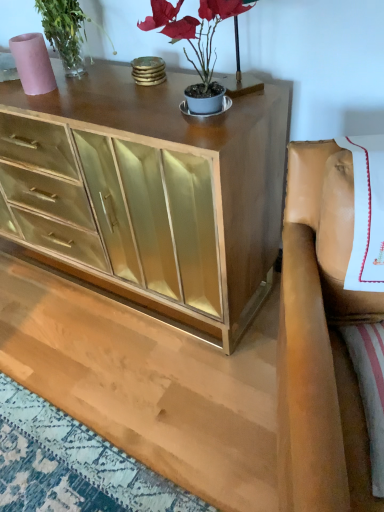
Question: Can you confirm if matte pink vase at upper left is taller than matte gold plant at upper center?

Choices:
 (A) yes
 (B) no

Answer: (B)

Question: Does matte pink vase at upper left appear on the left side of matte gold plant at upper center?

Choices:
 (A) yes
 (B) no

Answer: (A)

Question: Are matte pink vase at upper left and matte gold plant at upper center located far from each other?

Choices:
 (A) no
 (B) yes

Answer: (A)

Question: Does matte pink vase at upper left lie behind matte gold plant at upper center?

Choices:
 (A) no
 (B) yes

Answer: (B)

Question: Is matte pink vase at upper left bigger than matte gold plant at upper center?

Choices:
 (A) yes
 (B) no

Answer: (B)

Question: From a real-world perspective, is leather at right above or below matte gold plant at upper center?

Choices:
 (A) above
 (B) below

Answer: (B)

Question: From the image's perspective, relative to matte gold plant at upper center, is leather at right above or below?

Choices:
 (A) below
 (B) above

Answer: (A)

Question: Would you say leather at right is inside or outside matte gold plant at upper center?

Choices:
 (A) inside
 (B) outside

Answer: (B)

Question: Looking at the image, does leather at right seem bigger or smaller compared to matte gold plant at upper center?

Choices:
 (A) big
 (B) small

Answer: (A)

Question: Is point (331, 187) positioned closer to the camera than point (39, 60)?

Choices:
 (A) closer
 (B) farther

Answer: (A)

Question: From the image's perspective, relative to matte pink vase at upper left, is leather at right above or below?

Choices:
 (A) above
 (B) below

Answer: (B)

Question: In terms of size, does leather at right appear bigger or smaller than matte pink vase at upper left?

Choices:
 (A) big
 (B) small

Answer: (A)

Question: Considering the relative positions of leather at right and matte pink vase at upper left in the image provided, is leather at right to the left or to the right of matte pink vase at upper left?

Choices:
 (A) right
 (B) left

Answer: (A)

Question: In the image, is leather at right on the left side or the right side of gold mirrored cabinet at center?

Choices:
 (A) left
 (B) right

Answer: (B)

Question: Considering the positions of point (306, 384) and point (21, 188), is point (306, 384) closer or farther from the camera than point (21, 188)?

Choices:
 (A) farther
 (B) closer

Answer: (B)